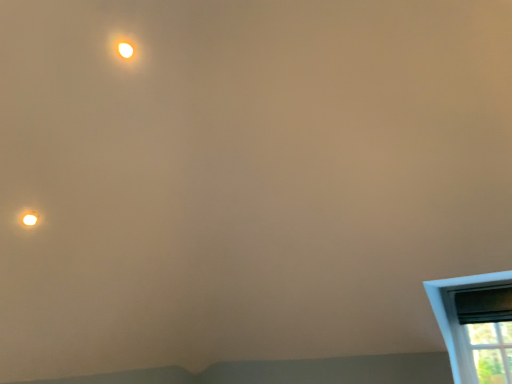
Question: Should I look upward or downward to see black plastic window screen at lower right?

Choices:
 (A) down
 (B) up

Answer: (A)

Question: Would you say black plastic window screen at lower right is outside matte white droplight at upper left?

Choices:
 (A) no
 (B) yes

Answer: (B)

Question: Does black plastic window screen at lower right turn towards matte white droplight at upper left?

Choices:
 (A) yes
 (B) no

Answer: (B)

Question: Is black plastic window screen at lower right positioned in front of matte white droplight at upper left?

Choices:
 (A) yes
 (B) no

Answer: (B)

Question: From a real-world perspective, is black plastic window screen at lower right positioned under matte white droplight at upper left based on gravity?

Choices:
 (A) no
 (B) yes

Answer: (B)

Question: Does black plastic window screen at lower right come behind matte white droplight at upper left?

Choices:
 (A) yes
 (B) no

Answer: (A)

Question: Does black plastic window screen at lower right have a larger size compared to matte white droplight at upper left?

Choices:
 (A) yes
 (B) no

Answer: (A)

Question: From a real-world perspective, is black plastic window screen at lower right on matte white light at upper left?

Choices:
 (A) no
 (B) yes

Answer: (A)

Question: From the image's perspective, is black plastic window screen at lower right above matte white light at upper left?

Choices:
 (A) no
 (B) yes

Answer: (A)

Question: Is black plastic window screen at lower right with matte white light at upper left?

Choices:
 (A) yes
 (B) no

Answer: (B)

Question: From a real-world perspective, is black plastic window screen at lower right located beneath matte white light at upper left?

Choices:
 (A) no
 (B) yes

Answer: (B)

Question: Is matte white light at upper left at the back of black plastic window screen at lower right?

Choices:
 (A) yes
 (B) no

Answer: (B)

Question: Does black plastic window screen at lower right have a smaller size compared to matte white light at upper left?

Choices:
 (A) yes
 (B) no

Answer: (B)

Question: Considering the relative sizes of matte white droplight at upper left and matte white light at upper left in the image provided, is matte white droplight at upper left wider than matte white light at upper left?

Choices:
 (A) yes
 (B) no

Answer: (A)